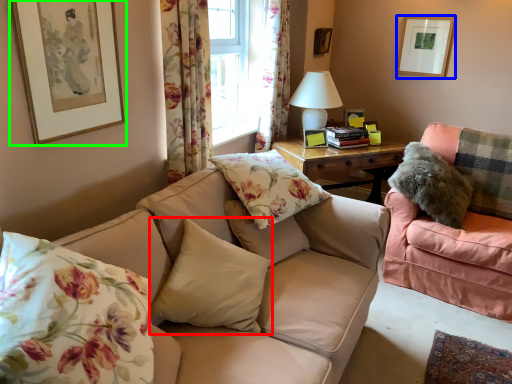
Question: Considering the real-world distances, which object is closest to pillow (highlighted by a red box)? picture frame (highlighted by a blue box) or picture frame (highlighted by a green box).

Choices:
 (A) picture frame
 (B) picture frame

Answer: (B)